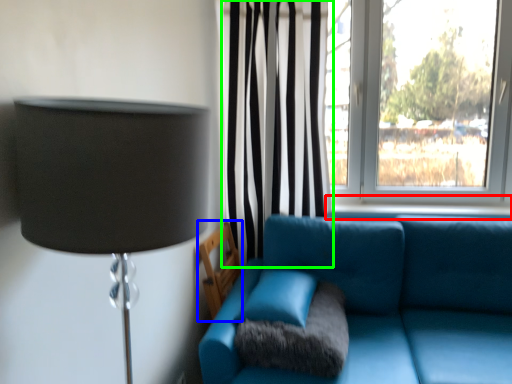
Question: Which object is the closest to the window sill (highlighted by a red box)? Choose among these: armchair (highlighted by a blue box) or curtain (highlighted by a green box).

Choices:
 (A) armchair
 (B) curtain

Answer: (B)